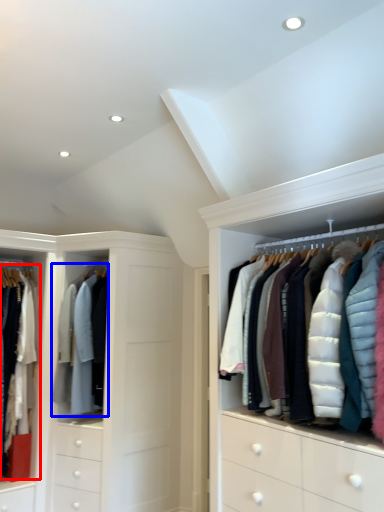
Question: Which point is closer to the camera, clothing (highlighted by a red box) or clothing (highlighted by a blue box)?

Choices:
 (A) clothing
 (B) clothing

Answer: (A)